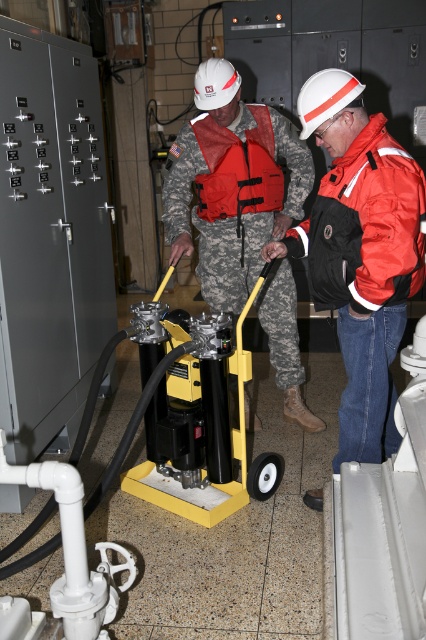
From the picture: You are a safety inspector in this industrial setting. You notice two workers in the scene described. One is wearing a camouflage uniform at center, and the other is wearing an orange matte jacket at right. According to safety protocols, workers must maintain a minimum distance of 2 meters between each other when operating machinery. Can you determine if they are complying with this rule based on their positions?

The camouflage uniform at center is positioned under orange matte jacket at right, which means they are close to each other vertically. Since the minimum distance required is 2 meters, they are likely not complying with the safety protocol.

You are standing at the point labeled as point [380,292] in an industrial setting. You need to reach a control panel located 2 meters away from your current position. Can you safely reach the control panel without moving your position?

The distance between point [380,292] and the camera is 1.96 meters, which is slightly less than 2 meters. Therefore, the control panel located 2 meters away may not be reachable from your current position without moving.

You are an inspector in this industrial setting. You need to determine if the camouflage uniform at center is positioned above or below the red fabric life vest at center. Based on the scene, what is the correct spatial relationship?

The camouflage uniform at center is below the red fabric life vest at center.